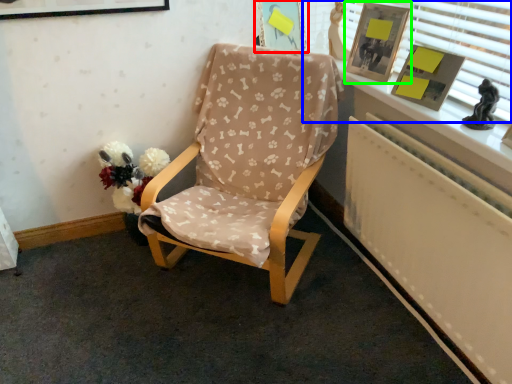
Question: Based on their relative distances, which object is farther from picture frame (highlighted by a red box)? Choose from window frame (highlighted by a blue box) and picture frame (highlighted by a green box).

Choices:
 (A) window frame
 (B) picture frame

Answer: (A)